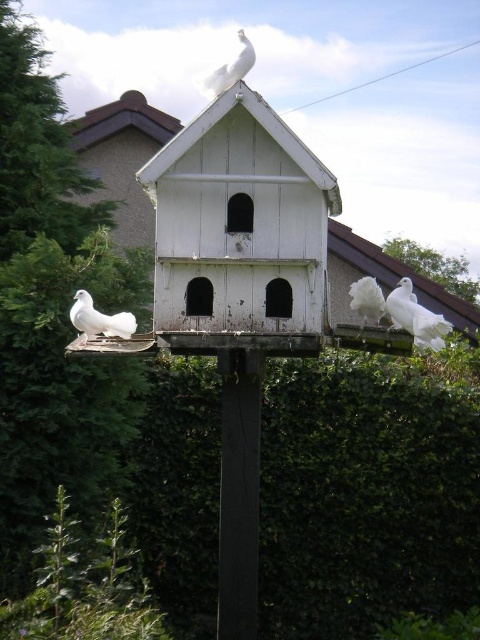
Who is lower down, green leafy hedge at center or white feathered dove at right?

green leafy hedge at center is below.

From the picture: Can you confirm if green leafy hedge at center is taller than white feathered dove at right?

Yes.

Locate an element on the screen. Image resolution: width=480 pixels, height=640 pixels. green leafy hedge at center is located at coordinates (368, 490).

Identify the location of green leafy hedge at center. The image size is (480, 640). (368, 490).

Does white glossy dove at lower left come in front of white feathered dove at center?

No.

Between white glossy dove at lower left and white feathered dove at center, which one appears on the right side from the viewer's perspective?

white feathered dove at center is more to the right.

In order to click on white glossy dove at lower left in this screenshot , I will do `click(98, 320)`.

The image size is (480, 640). What are the coordinates of `white glossy dove at lower left` in the screenshot? It's located at (98, 320).

Measure the distance between white feathered dove at right and camera.

They are 8.06 feet apart.

Does white feathered dove at right have a larger size compared to white feathered dove at center?

Indeed, white feathered dove at right has a larger size compared to white feathered dove at center.

This screenshot has height=640, width=480. I want to click on white feathered dove at right, so click(416, 317).

This screenshot has width=480, height=640. In order to click on white feathered dove at right in this screenshot , I will do `click(416, 317)`.